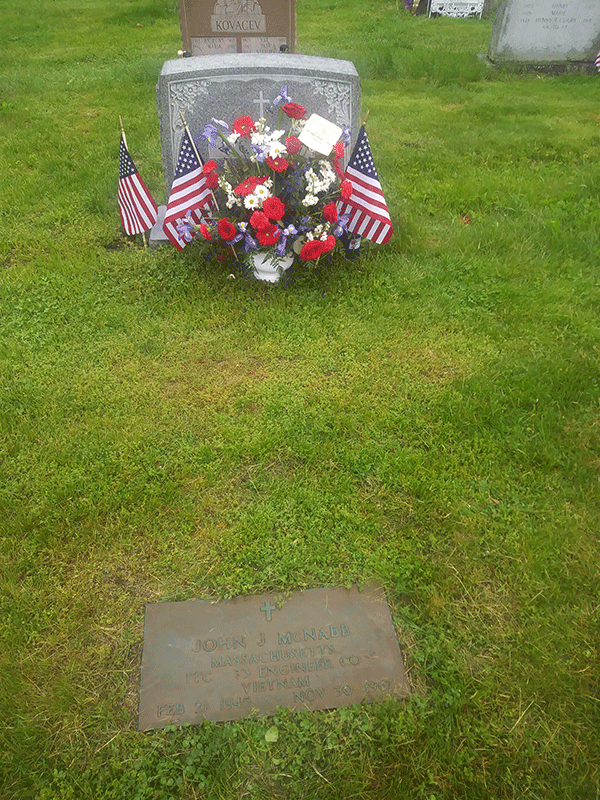
Where is `white vase`? The image size is (600, 800). white vase is located at coordinates (263, 270).